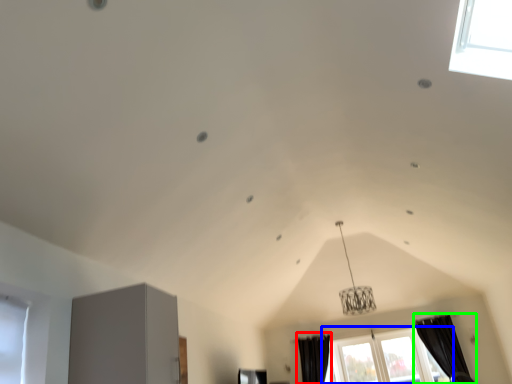
Question: Estimate the real-world distances between objects in this image. Which object is closer to curtain (highlighted by a red box), window (highlighted by a blue box) or curtain (highlighted by a green box)?

Choices:
 (A) window
 (B) curtain

Answer: (A)